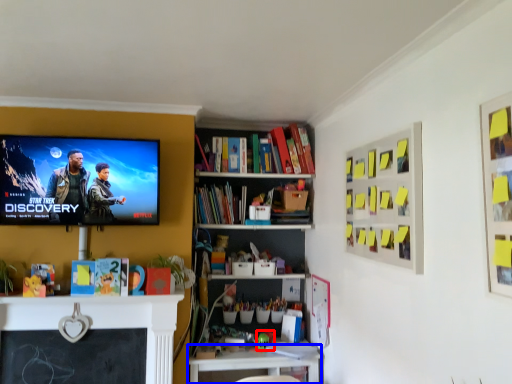
Question: Which object appears closest to the camera in this image, toy (highlighted by a red box) or table (highlighted by a blue box)?

Choices:
 (A) toy
 (B) table

Answer: (B)